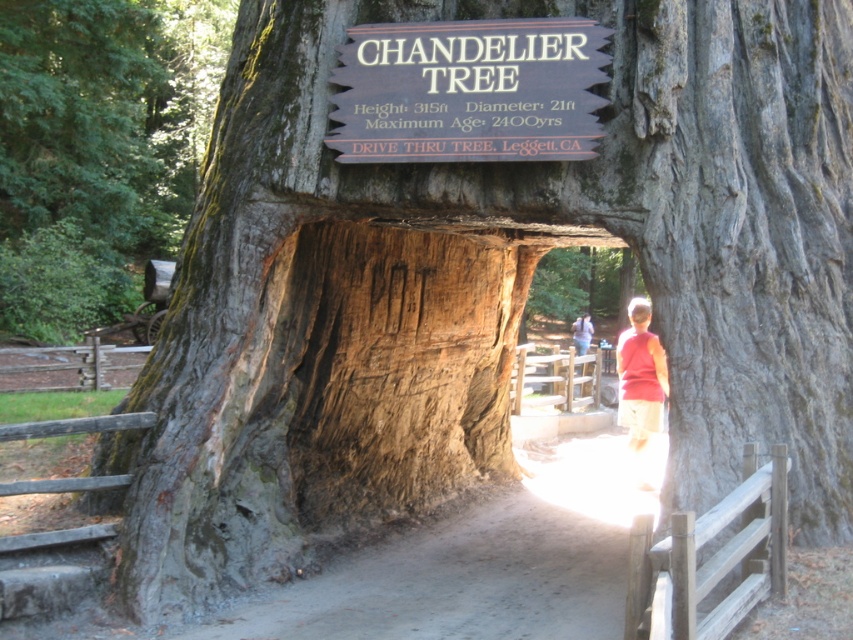
You are a visitor standing at the entrance of the Chandelier Tree tunnel. You see a wooden sign at center and a red shirt at center. Which object is closer to you?

The wooden sign at center is closer to the viewer than the red shirt at center.